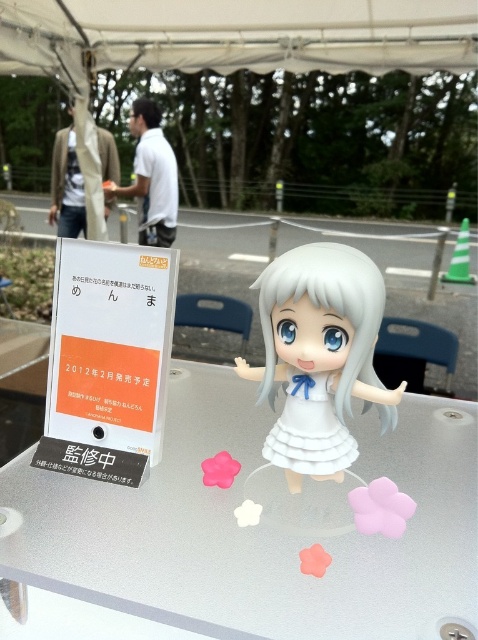
You are standing in front of the display setup under the white canopy tent. You notice two points marked on the display. The first point is at coordinate point (420, 515) and the second point is at coordinate point (315, 461). Which point is closer to you?

Point (420, 515) is further to the viewer than point (315, 461), so the second point at (315, 461) is closer to you.

You are a photographer taking a picture of the transparent acrylic table at center and the white matte dress at center. Which object will appear larger in your photo?

The transparent acrylic table at center will appear larger in the photo because it is closer to the viewer than the white matte dress at center.